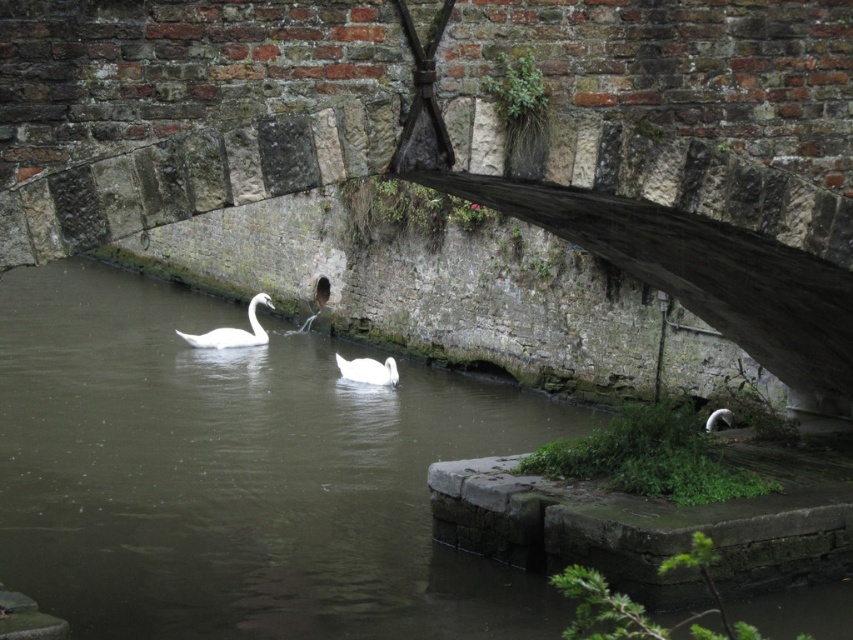
You are standing on the arched stone bridge and want to take a photo of the clear water at center. Where should you aim your camera to capture it?

You should aim your camera at point (239, 476) to capture the clear water at center.

You are standing on the arched stone bridge in the image and notice two points marked on the water below. The first point is labeled as point (248, 333) and the second is point (344, 376). Which point is closer to you as you stand on the bridge?

Point (248, 333) is closer to you than point (344, 376) because it is further to the viewer.

You are a photographer aiming to capture the white glossy swan at left and the clear water at center in your shot. Based on their positions, which object appears closer to the camera?

The clear water at center appears closer to the camera because it is much taller than the white glossy swan at left, indicating it occupies more of the frame vertically, which typically suggests proximity in perspective.